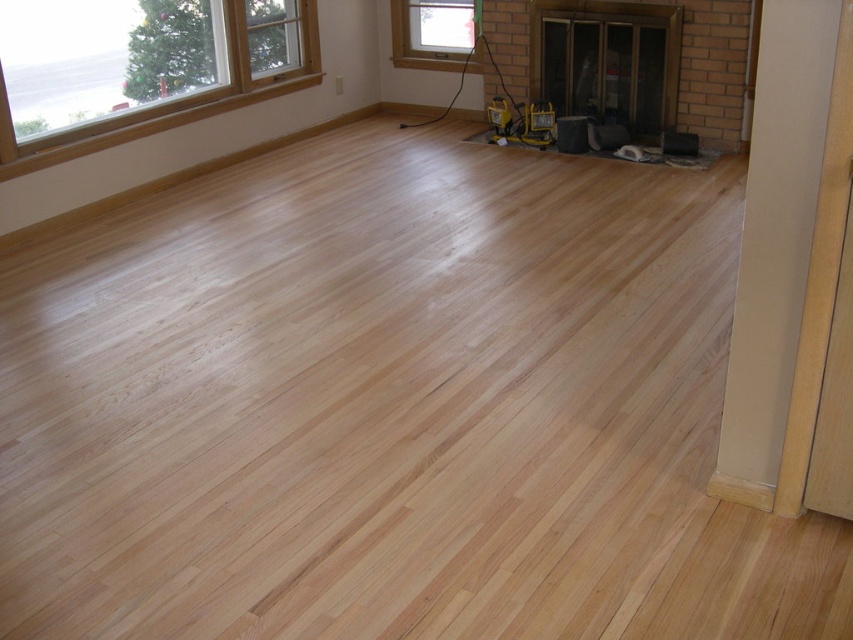
Question: Is natural wood floor at center wider than yellow plastic tool at center?

Choices:
 (A) yes
 (B) no

Answer: (A)

Question: Considering the real-world distances, which object is farthest from the natural wood floor at center?

Choices:
 (A) clear glass window at upper left
 (B) yellow plastic tool at center
 (C) clear glass window at upper center

Answer: (C)

Question: Can you confirm if clear glass window at upper left is smaller than clear glass window at upper center?

Choices:
 (A) no
 (B) yes

Answer: (A)

Question: Estimate the real-world distances between objects in this image. Which object is closer to the yellow plastic tool at center?

Choices:
 (A) clear glass window at upper left
 (B) natural wood floor at center

Answer: (A)

Question: Among these points, which one is nearest to the camera?

Choices:
 (A) (500, 122)
 (B) (16, 173)

Answer: (B)

Question: Is the position of natural wood floor at center less distant than that of clear glass window at upper center?

Choices:
 (A) yes
 (B) no

Answer: (A)